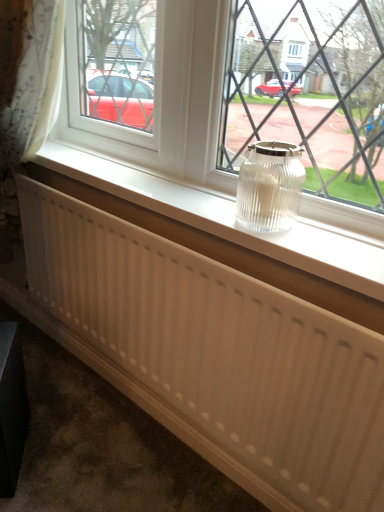
Identify the location of white plastic radiator at center. (228, 219).

Find the location of a particular element. The width and height of the screenshot is (384, 512). white ribbed radiator at center is located at coordinates (213, 354).

Which of these two, white plastic radiator at center or clear glass jar at center, is smaller?

white plastic radiator at center is smaller.

Between white plastic radiator at center and clear glass jar at center, which one has smaller width?

clear glass jar at center is thinner.

Which object is closer to the camera taking this photo, white plastic radiator at center or clear glass jar at center?

Positioned in front is clear glass jar at center.

Does white plastic radiator at center turn towards clear glass jar at center?

No, white plastic radiator at center is not aimed at clear glass jar at center.

From a real-world perspective, is clear glass jar at center over clear glass jar at center?

No, from a real-world perspective, clear glass jar at center is not on top of clear glass jar at center.

The image size is (384, 512). I want to click on window on the left of clear glass jar at center, so click(x=164, y=97).

Does clear glass jar at center appear on the left side of clear glass jar at center?

Incorrect, clear glass jar at center is not on the left side of clear glass jar at center.

Considering the relative positions of clear glass jar at center and clear glass jar at center in the image provided, is clear glass jar at center to the left or to the right of clear glass jar at center?

clear glass jar at center is positioned on clear glass jar at center's left side.

Is clear glass jar at center turned away from clear glass jar at center?

Yes, clear glass jar at center's orientation is away from clear glass jar at center.

From the picture: Which object is further away from the camera, clear glass jar at center or clear glass jar at center?

clear glass jar at center is behind.

You are a GUI agent. You are given a task and a screenshot of the screen. Output one action in this format:
    pyautogui.click(x=<x>, y=<y>)
    Task: Click on the window on the left of clear glass jar at center
    This screenshot has width=384, height=512.
    Given the screenshot: What is the action you would take?
    pyautogui.click(x=164, y=97)

Can you confirm if white ribbed radiator at center is shorter than clear glass jar at center?

In fact, white ribbed radiator at center may be taller than clear glass jar at center.

Consider the image. Which object is closer to the camera, white ribbed radiator at center or clear glass jar at center?

clear glass jar at center is closer to the camera.

Considering the sizes of white ribbed radiator at center and clear glass jar at center in the image, is white ribbed radiator at center bigger or smaller than clear glass jar at center?

Considering their sizes, white ribbed radiator at center takes up less space than clear glass jar at center.

Which is closer, (71,296) or (208,137)?

Point (208,137)

Considering the sizes of white plastic radiator at center and clear glass jar at center in the image, is white plastic radiator at center wider or thinner than clear glass jar at center?

In the image, white plastic radiator at center appears to be wider than clear glass jar at center.

Which is nearer, (184, 197) or (275, 190)?

Point (184, 197) appears to be farther away from the viewer than point (275, 190).

Considering the positions of objects white plastic radiator at center and clear glass jar at center in the image provided, who is in front, white plastic radiator at center or clear glass jar at center?

Positioned in front is white plastic radiator at center.

What's the angular difference between clear glass jar at center and white ribbed radiator at center's facing directions?

clear glass jar at center and white ribbed radiator at center are facing 4.03 degrees away from each other.

Is clear glass jar at center shorter than white ribbed radiator at center?

Yes, clear glass jar at center is shorter than white ribbed radiator at center.

Between clear glass jar at center and white ribbed radiator at center, which one appears on the left side from the viewer's perspective?

white ribbed radiator at center is more to the left.

Considering the sizes of clear glass jar at center and white ribbed radiator at center in the image, is clear glass jar at center bigger or smaller than white ribbed radiator at center?

clear glass jar at center is smaller than white ribbed radiator at center.

Where is `window that appears above the white ribbed radiator at center (from a real-world perspective)`? The height and width of the screenshot is (512, 384). window that appears above the white ribbed radiator at center (from a real-world perspective) is located at coordinates (164, 97).

Who is more distant, clear glass jar at center or white ribbed radiator at center?

white ribbed radiator at center is behind.

Is clear glass jar at center facing away from white ribbed radiator at center?

No, clear glass jar at center is not facing away from white ribbed radiator at center.

Considering the points (218, 8) and (383, 469), which point is behind, point (218, 8) or point (383, 469)?

The point (218, 8) is more distant.

This screenshot has height=512, width=384. Find the location of `window sill below the clear glass jar at center (from the image's perspective)`. window sill below the clear glass jar at center (from the image's perspective) is located at coordinates (228, 219).

Find the location of a particular element. Image resolution: width=384 pixels, height=512 pixels. glass vase that is behind the clear glass jar at center is located at coordinates (270, 186).

Looking at the image, which one is located closer to clear glass jar at center, white ribbed radiator at center or clear glass jar at center?

Based on the image, clear glass jar at center appears to be nearer to clear glass jar at center.

Looking at the image, which one is located closer to clear glass jar at center, clear glass jar at center or white ribbed radiator at center?

The object closer to clear glass jar at center is clear glass jar at center.

From the image, which object appears to be nearer to clear glass jar at center, clear glass jar at center or white ribbed radiator at center?

clear glass jar at center lies closer to clear glass jar at center than the other object.

Considering their positions, is clear glass jar at center positioned closer to white plastic radiator at center than white ribbed radiator at center?

The object closer to white plastic radiator at center is clear glass jar at center.

Looking at the image, which one is located further to white plastic radiator at center, clear glass jar at center or clear glass jar at center?

Among the two, clear glass jar at center is located further to white plastic radiator at center.

When comparing their distances from clear glass jar at center, does white plastic radiator at center or clear glass jar at center seem further?

clear glass jar at center is positioned further to the anchor clear glass jar at center.

Which object lies nearer to the anchor point clear glass jar at center, white ribbed radiator at center or white plastic radiator at center?

white plastic radiator at center is positioned closer to the anchor clear glass jar at center.

Considering their positions, is white plastic radiator at center positioned further to white ribbed radiator at center than clear glass jar at center?

The object further to white ribbed radiator at center is clear glass jar at center.

What are the coordinates of `glass vase between white plastic radiator at center and white ribbed radiator at center from top to bottom` in the screenshot? It's located at (270, 186).

Locate an element on the screen. glass vase between clear glass jar at center and white ribbed radiator at center in the vertical direction is located at coordinates (x=270, y=186).

Locate an element on the screen. Image resolution: width=384 pixels, height=512 pixels. window sill between clear glass jar at center and white ribbed radiator at center in the up-down direction is located at coordinates (228, 219).

Image resolution: width=384 pixels, height=512 pixels. Identify the location of window sill situated between clear glass jar at center and clear glass jar at center from left to right. (228, 219).